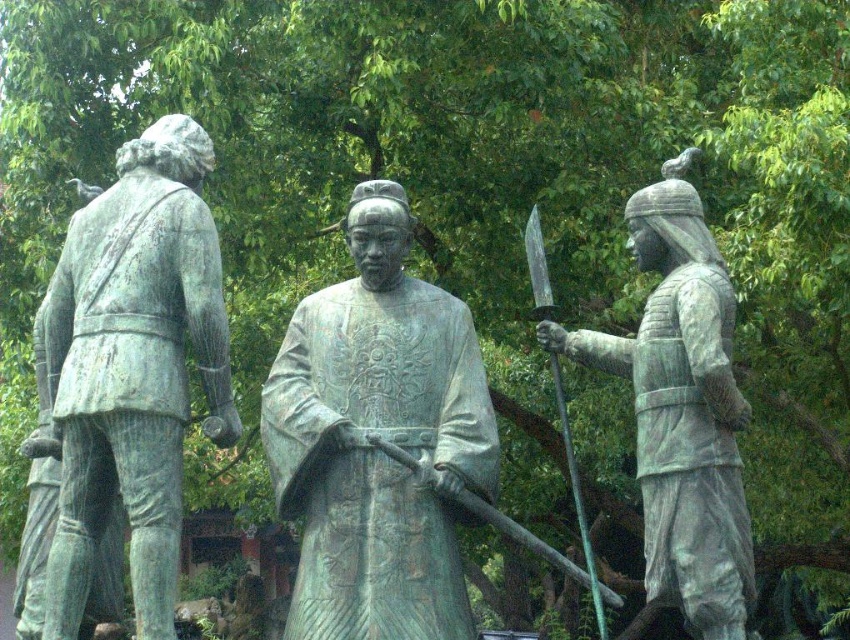
You are standing in front of the three bronze statues in the image. The central statue has a point marked at coordinates [381,436]. Can you identify which statue this point corresponds to?

The point at coordinates [381,436] corresponds to the green patina statue at center.

You are an art conservator assessing the statues in the image. Which object has a smaller width between the green patina statue at left and the polished steel sword at center right?

The green patina statue at left is thinner than the polished steel sword at center right, so the green patina statue at left has a smaller width.

From the picture: You are a photographer standing at the camera position. You want to take a closeup shot of the green patina statue at center. Considering the statue is 38.79 meters away from you, can you use a standard 50mm lens to achieve this without moving closer?

The green patina statue at center is 38.79 meters away from the camera. A standard 50mm lens typically captures a field of view that may not be sufficient to fill the frame with the statue from that distance. You would likely need a telephoto lens with a longer focal length to get a closeup without moving closer.